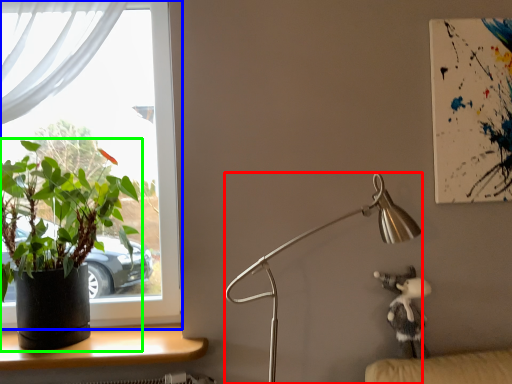
Question: Estimate the real-world distances between objects in this image. Which object is closer to lamp (highlighted by a red box), window (highlighted by a blue box) or houseplant (highlighted by a green box)?

Choices:
 (A) window
 (B) houseplant

Answer: (B)